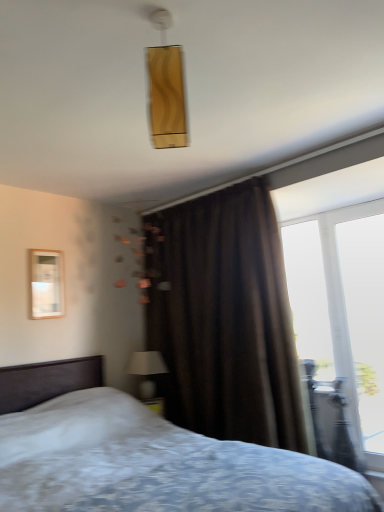
Question: Can you confirm if white textured bed at center is shorter than wooden frame at left?

Choices:
 (A) no
 (B) yes

Answer: (A)

Question: From the image's perspective, is white textured bed at center over wooden frame at left?

Choices:
 (A) yes
 (B) no

Answer: (B)

Question: Is white textured bed at center positioned with its back to wooden frame at left?

Choices:
 (A) no
 (B) yes

Answer: (A)

Question: Does white textured bed at center contain wooden frame at left?

Choices:
 (A) no
 (B) yes

Answer: (A)

Question: Is white textured bed at center smaller than wooden frame at left?

Choices:
 (A) yes
 (B) no

Answer: (B)

Question: Can you confirm if white textured bed at center is thinner than wooden frame at left?

Choices:
 (A) no
 (B) yes

Answer: (A)

Question: Is wooden frame at left outside of brown velvet curtain at center?

Choices:
 (A) no
 (B) yes

Answer: (B)

Question: Is brown velvet curtain at center a part of wooden frame at left?

Choices:
 (A) yes
 (B) no

Answer: (B)

Question: Is wooden frame at left facing away from brown velvet curtain at center?

Choices:
 (A) yes
 (B) no

Answer: (B)

Question: Is there a large distance between wooden frame at left and brown velvet curtain at center?

Choices:
 (A) no
 (B) yes

Answer: (B)

Question: From the image's perspective, is wooden frame at left over brown velvet curtain at center?

Choices:
 (A) yes
 (B) no

Answer: (A)

Question: Does wooden frame at left appear on the left side of brown velvet curtain at center?

Choices:
 (A) yes
 (B) no

Answer: (A)

Question: Is white textured bed at center smaller than brown velvet curtain at center?

Choices:
 (A) yes
 (B) no

Answer: (B)